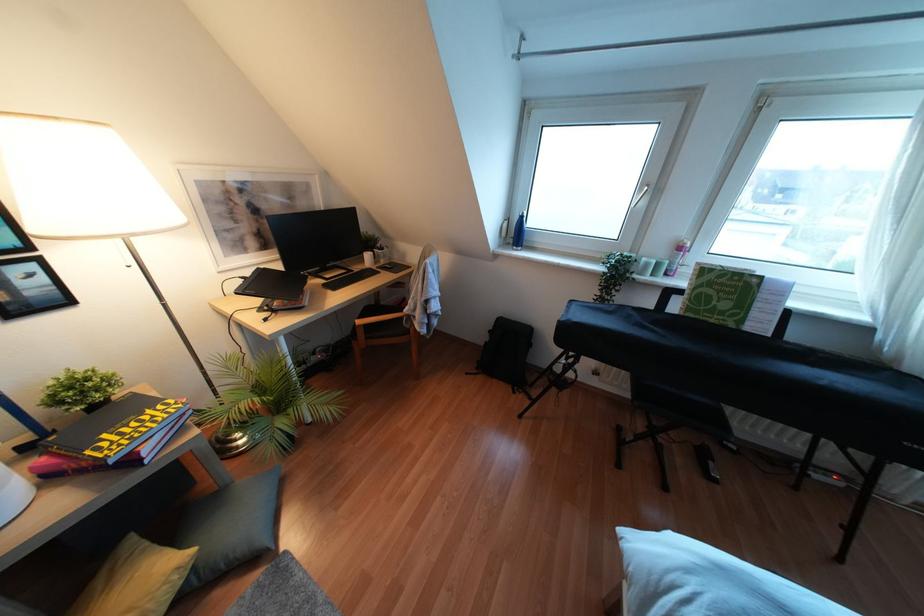
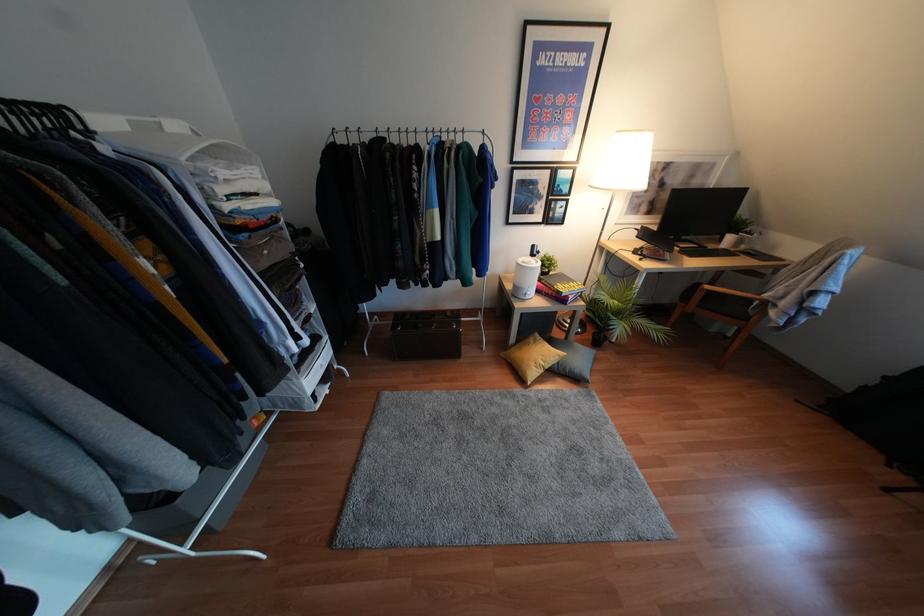
Where in the second image is the point corresponding to point (358, 321) from the first image?

(707, 286)